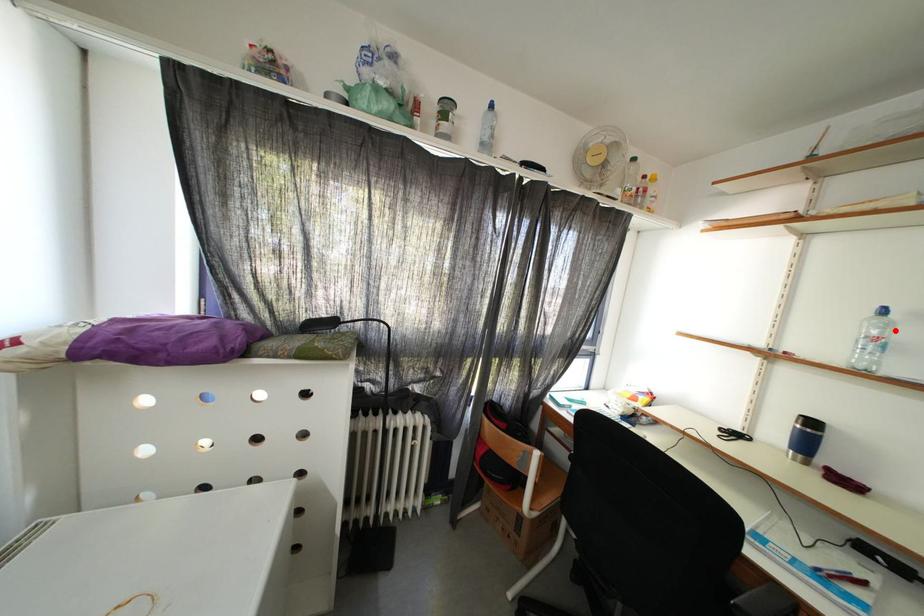
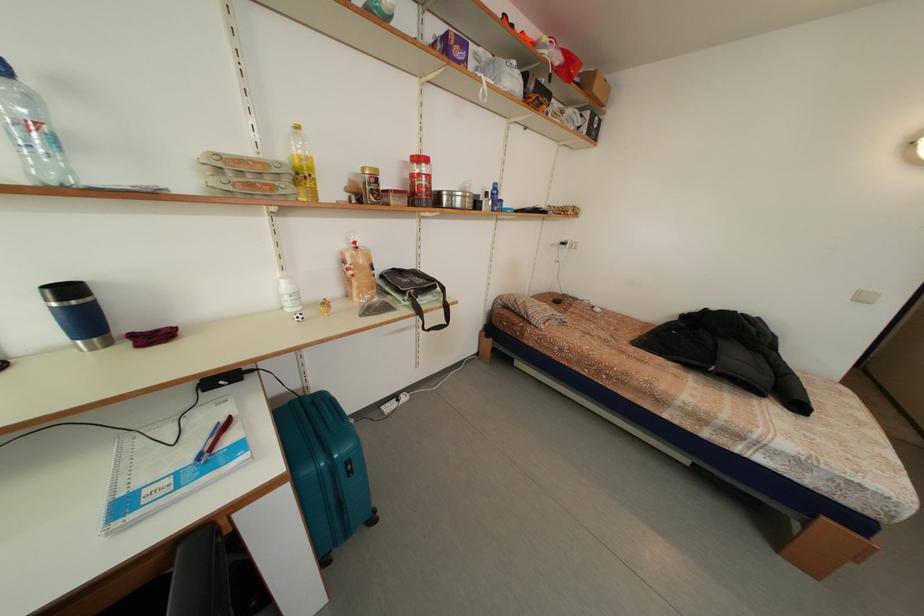
In the second image, find the point that corresponds to the highlighted location in the first image.

(40, 106)